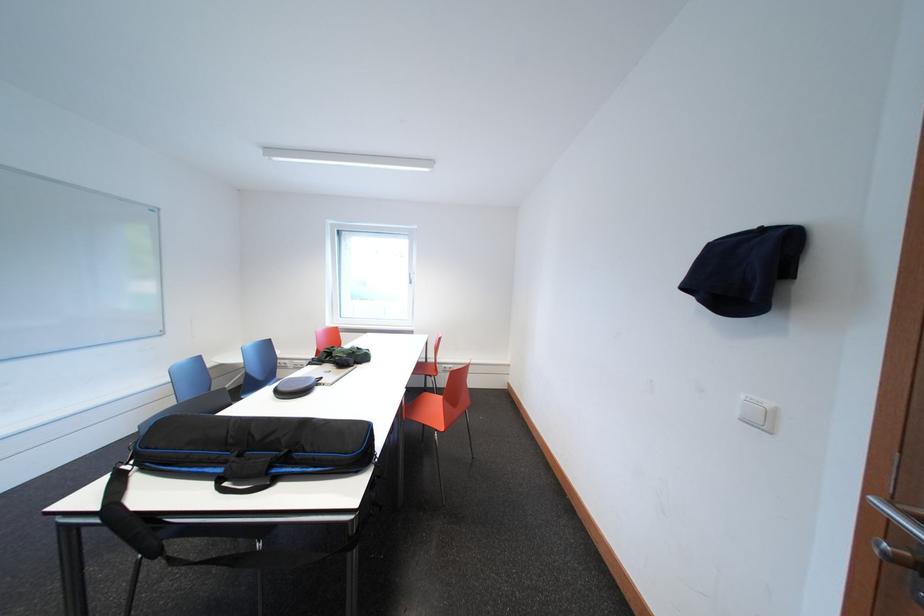
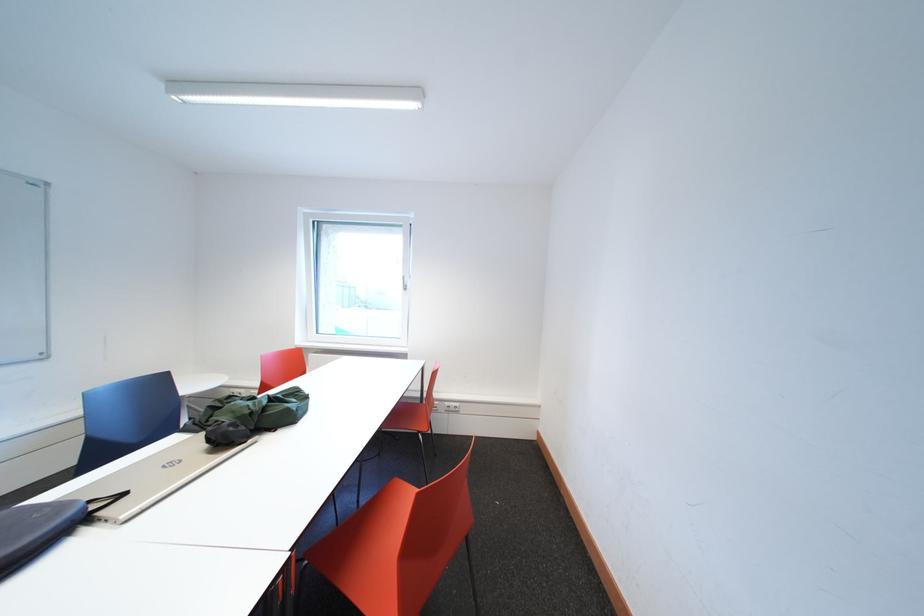
Find the pixel in the second image that matches point 433,363 in the first image.

(429, 400)